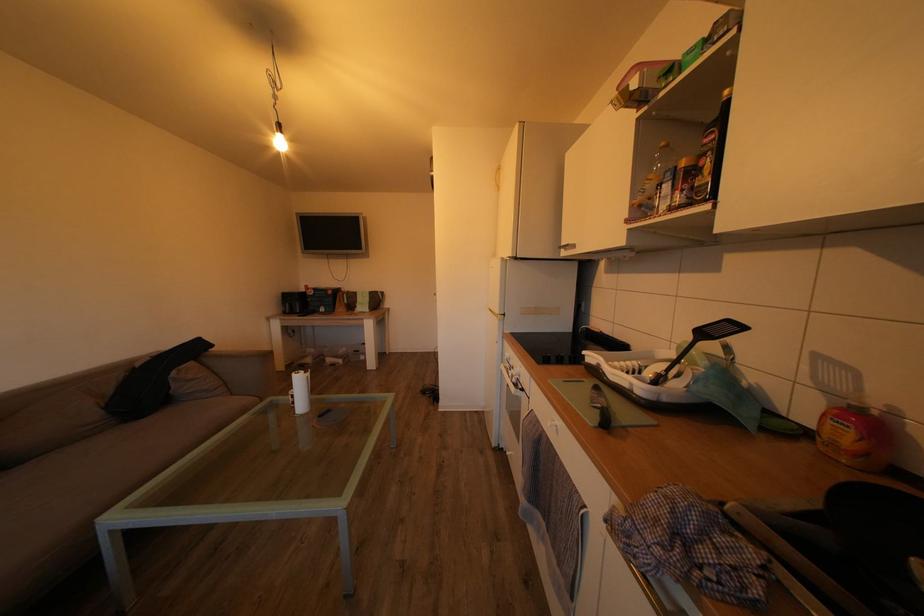
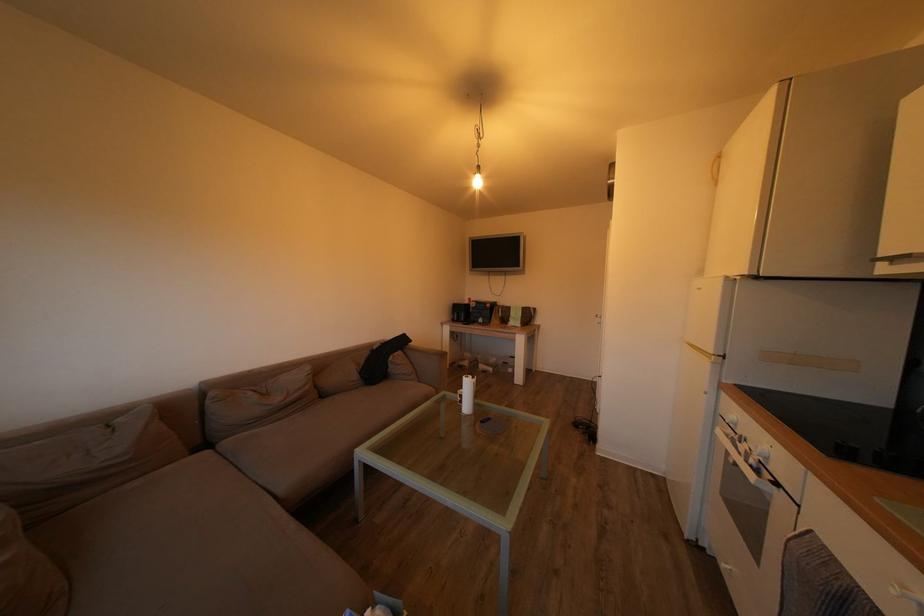
Where in the second image is the point corresponding to the point at 220,352 from the first image?

(419, 347)